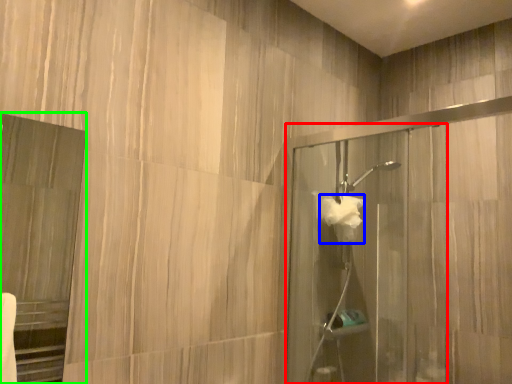
Question: Which object is the farthest from screen door (highlighted by a red box)? Choose among these: hand towel (highlighted by a blue box) or screen door (highlighted by a green box).

Choices:
 (A) hand towel
 (B) screen door

Answer: (B)